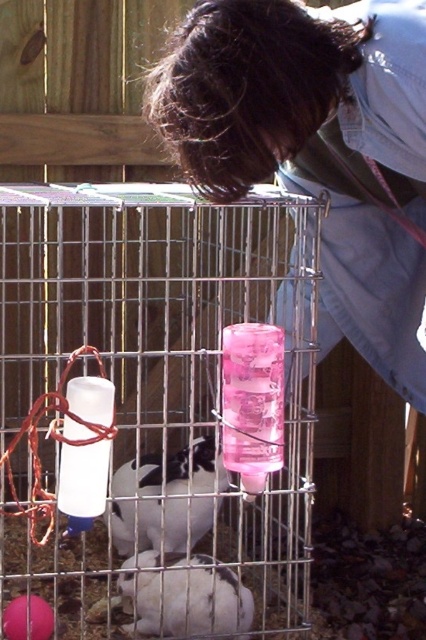
Consider the image. Is pink plastic water bottle at center smaller than white matte rabbit at center?

Incorrect, pink plastic water bottle at center is not smaller in size than white matte rabbit at center.

Does pink plastic water bottle at center appear on the left side of white matte rabbit at center?

Yes, pink plastic water bottle at center is to the left of white matte rabbit at center.

What do you see at coordinates (152, 410) in the screenshot? The image size is (426, 640). I see `pink plastic water bottle at center` at bounding box center [152, 410].

At what (x,y) coordinates should I click in order to perform the action: click on pink plastic water bottle at center. Please return your answer as a coordinate pair (x, y). The width and height of the screenshot is (426, 640). Looking at the image, I should click on (152, 410).

Does pink plastic water bottle at center come behind white fur rabbit at lower center?

No, pink plastic water bottle at center is closer to the viewer.

Can you confirm if pink plastic water bottle at center is taller than white fur rabbit at lower center?

Yes.

Where is `pink plastic water bottle at center`? This screenshot has width=426, height=640. pink plastic water bottle at center is located at coordinates (152, 410).

Is point (138, 545) closer to camera compared to point (233, 604)?

That is False.

Between white matte rabbit at center and white fur rabbit at lower center, which one has more height?

white matte rabbit at center is taller.

Does point (173, 481) come behind point (218, 596)?

That is True.

The height and width of the screenshot is (640, 426). Find the location of `white matte rabbit at center`. white matte rabbit at center is located at coordinates (175, 500).